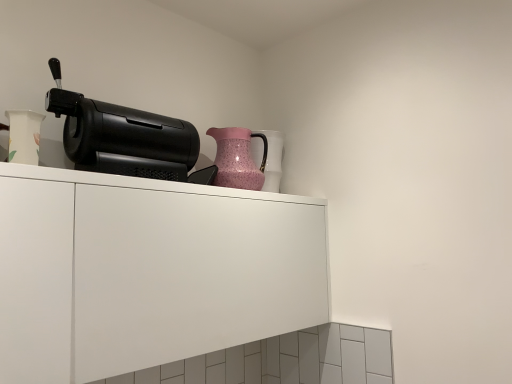
Question: From the image's perspective, is pink textured vase at upper center, placed as the 2th vase when sorted from left to right, located beneath white matte cabinet at upper center?

Choices:
 (A) yes
 (B) no

Answer: (B)

Question: From the image's perspective, is pink textured vase at upper center, positioned as the second vase in front-to-back order, on top of white matte cabinet at upper center?

Choices:
 (A) yes
 (B) no

Answer: (A)

Question: Is pink textured vase at upper center, positioned as the second vase in front-to-back order, surrounding white matte cabinet at upper center?

Choices:
 (A) yes
 (B) no

Answer: (B)

Question: Considering the relative sizes of pink textured vase at upper center, acting as the first vase starting from the back, and white matte cabinet at upper center in the image provided, is pink textured vase at upper center, acting as the first vase starting from the back, thinner than white matte cabinet at upper center?

Choices:
 (A) no
 (B) yes

Answer: (B)

Question: Does pink textured vase at upper center, placed as the 2th vase when sorted from left to right, appear on the right side of white matte cabinet at upper center?

Choices:
 (A) yes
 (B) no

Answer: (A)

Question: Can we say pink textured vase at upper center, placed as the 2th vase when sorted from left to right, lies outside white matte cabinet at upper center?

Choices:
 (A) no
 (B) yes

Answer: (B)

Question: From a real-world perspective, is white glossy vase at left, the 2th vase positioned from the right, located higher than black plastic coffee machine at upper left?

Choices:
 (A) yes
 (B) no

Answer: (B)

Question: Are white glossy vase at left, which is counted as the second vase, starting from the back, and black plastic coffee machine at upper left making contact?

Choices:
 (A) yes
 (B) no

Answer: (B)

Question: Is white glossy vase at left, the first vase in the left-to-right sequence, facing away from black plastic coffee machine at upper left?

Choices:
 (A) no
 (B) yes

Answer: (A)

Question: Can you confirm if white glossy vase at left, which is the first vase in front-to-back order, is positioned to the right of black plastic coffee machine at upper left?

Choices:
 (A) no
 (B) yes

Answer: (A)

Question: Can you confirm if white glossy vase at left, the first vase in the left-to-right sequence, is smaller than black plastic coffee machine at upper left?

Choices:
 (A) yes
 (B) no

Answer: (A)

Question: Is white glossy vase at left, the 2th vase positioned from the right, closer to the viewer compared to black plastic coffee machine at upper left?

Choices:
 (A) yes
 (B) no

Answer: (A)

Question: Is white matte cabinet at upper center far away from pink speckled glass jug at upper right?

Choices:
 (A) no
 (B) yes

Answer: (A)